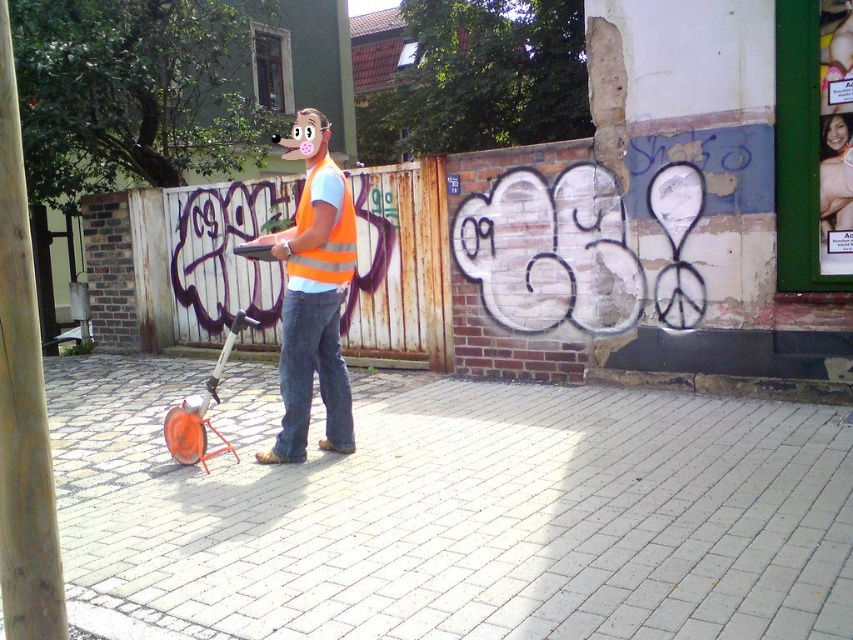
Is orange reflective vest at center further to camera compared to orange reflective safety vest at center?

That is False.

The height and width of the screenshot is (640, 853). Find the location of `orange reflective vest at center`. orange reflective vest at center is located at coordinates (314, 298).

Which is behind, point (323, 166) or point (344, 212)?

The point (344, 212) is behind.

You are a GUI agent. You are given a task and a screenshot of the screen. Output one action in this format:
    pyautogui.click(x=<x>, y=<y>)
    Task: Click on the orange reflective vest at center
    The height and width of the screenshot is (640, 853).
    Given the screenshot: What is the action you would take?
    pyautogui.click(x=314, y=298)

Between wooden pole at left and orange reflective vest at center, which one is positioned higher?

orange reflective vest at center

Between point (4, 456) and point (318, 170), which one is positioned behind?

Positioned behind is point (318, 170).

Image resolution: width=853 pixels, height=640 pixels. What are the coordinates of `wooden pole at left` in the screenshot? It's located at (22, 401).

Does white brick pavement at center come behind orange reflective safety vest at center?

No, white brick pavement at center is in front of orange reflective safety vest at center.

Can you confirm if white brick pavement at center is positioned to the right of orange reflective safety vest at center?

Correct, you'll find white brick pavement at center to the right of orange reflective safety vest at center.

Where is `white brick pavement at center`? white brick pavement at center is located at coordinates (457, 512).